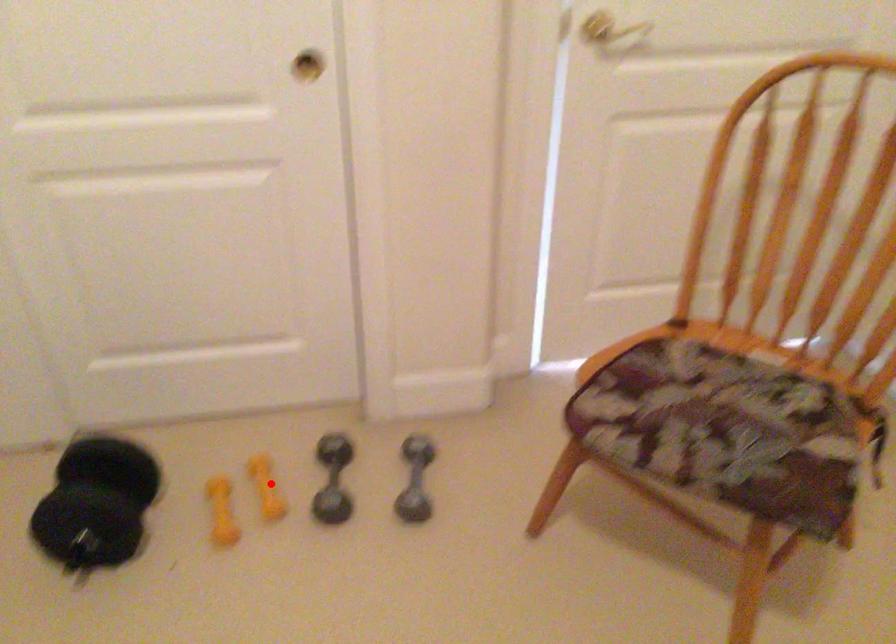
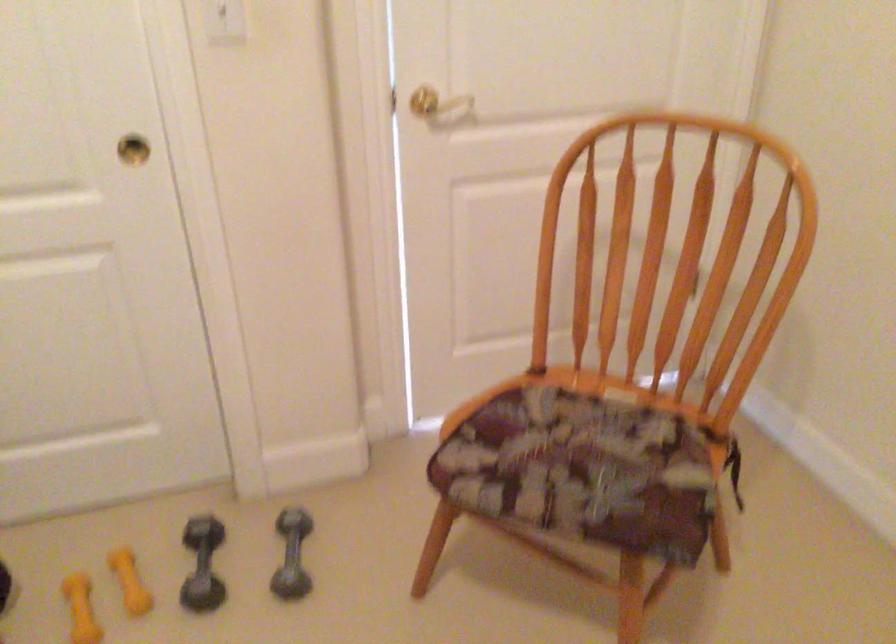
Question: I am providing you with two images of the same scene from different viewpoints. Image1 has a red point marked. In image2, the corresponding 3D location appears at what relative position? Reply with the corresponding letter.

Choices:
 (A) Closer
 (B) Farther

Answer: (A)